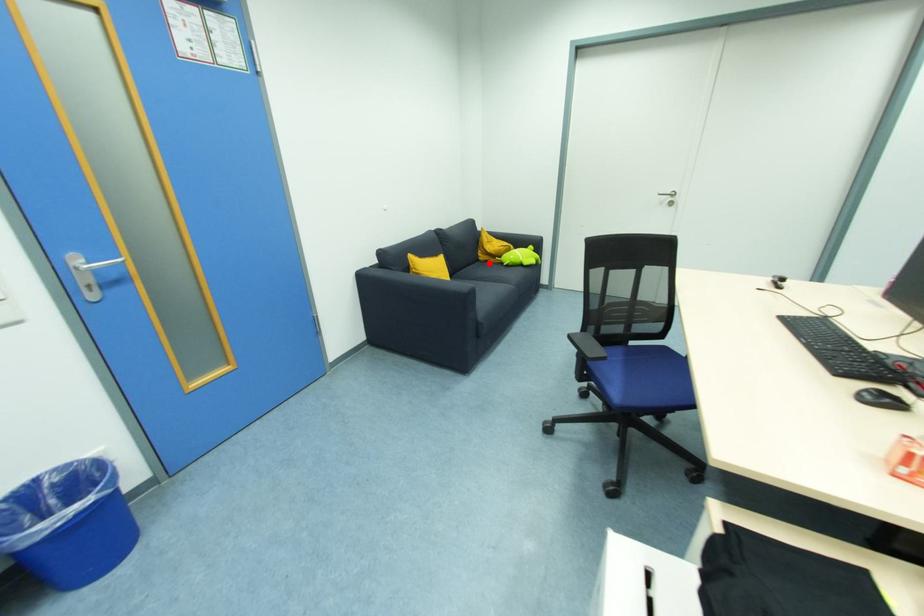
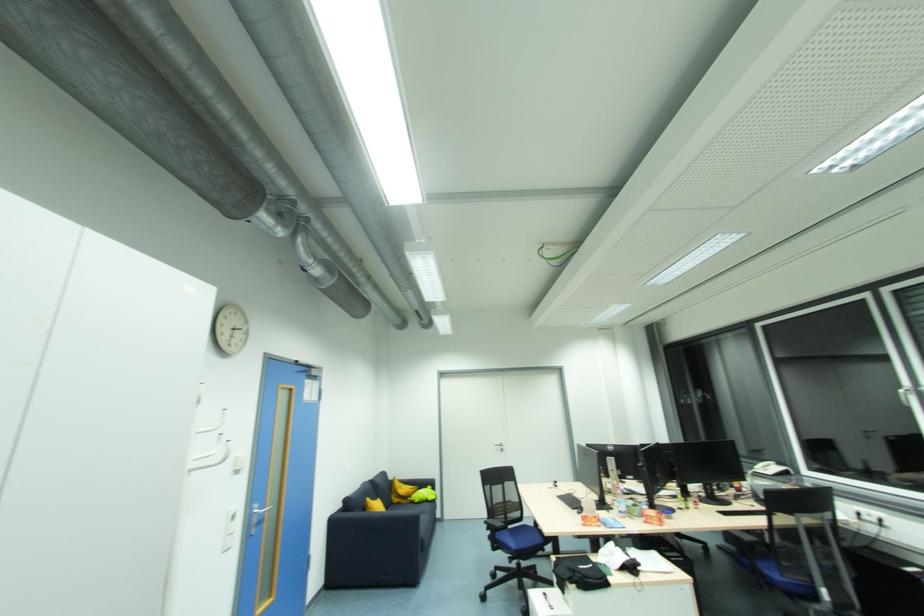
Question: I am providing you with two images of the same scene from different viewpoints. A red point is marked on the first image. Can you still see the location of the red point in image 2?

Choices:
 (A) Yes
 (B) No

Answer: (A)